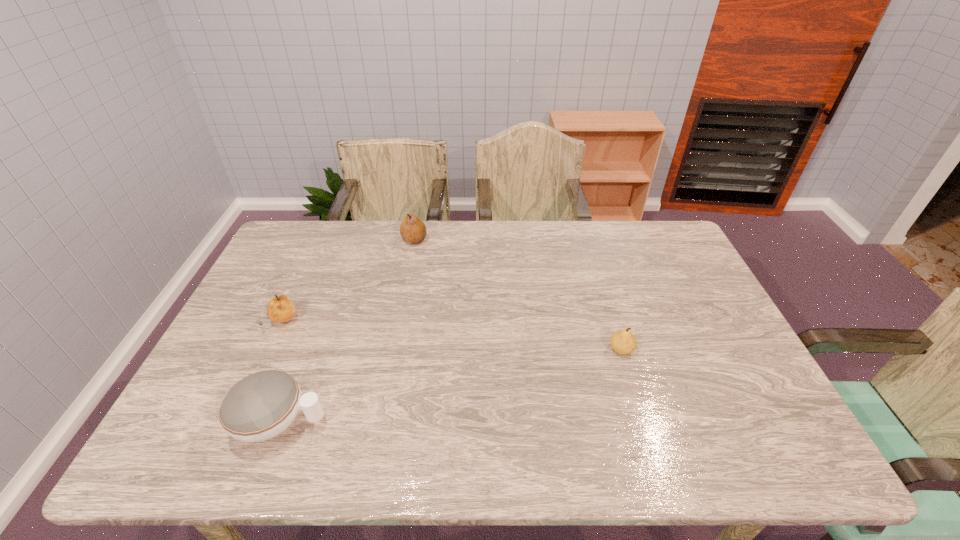
At what (x,y) coordinates should I click in order to perform the action: click on blank region between the nearest object and the farthest object. Please return your answer as a coordinate pair (x, y). This screenshot has width=960, height=540. Looking at the image, I should click on (348, 331).

Where is `free space between the tallest pear and the third farthest object`? Image resolution: width=960 pixels, height=540 pixels. free space between the tallest pear and the third farthest object is located at coordinates (517, 295).

Where is `vacant area that lies between the tallest object and the second farthest object`? vacant area that lies between the tallest object and the second farthest object is located at coordinates (348, 281).

This screenshot has height=540, width=960. Find the location of `vacant space that's between the second farthest object and the second nearest object`. vacant space that's between the second farthest object and the second nearest object is located at coordinates (452, 336).

At what (x,y) coordinates should I click in order to perform the action: click on free spot between the nearest pear and the leftmost pear. Please return your answer as a coordinate pair (x, y). Looking at the image, I should click on point(452,336).

The width and height of the screenshot is (960, 540). Identify the location of empty location between the leftmost pear and the rightmost object. (452, 336).

Locate an element on the screen. Image resolution: width=960 pixels, height=540 pixels. vacant area between the third nearest object and the rightmost pear is located at coordinates (452, 336).

Where is `vacant point located between the second object from right to left and the rightmost object`? Image resolution: width=960 pixels, height=540 pixels. vacant point located between the second object from right to left and the rightmost object is located at coordinates (517, 295).

Find the location of a particular element. unoccupied area between the tallest pear and the second farthest object is located at coordinates (348, 281).

Find the location of a particular element. free space between the nearest object and the rightmost pear is located at coordinates (451, 386).